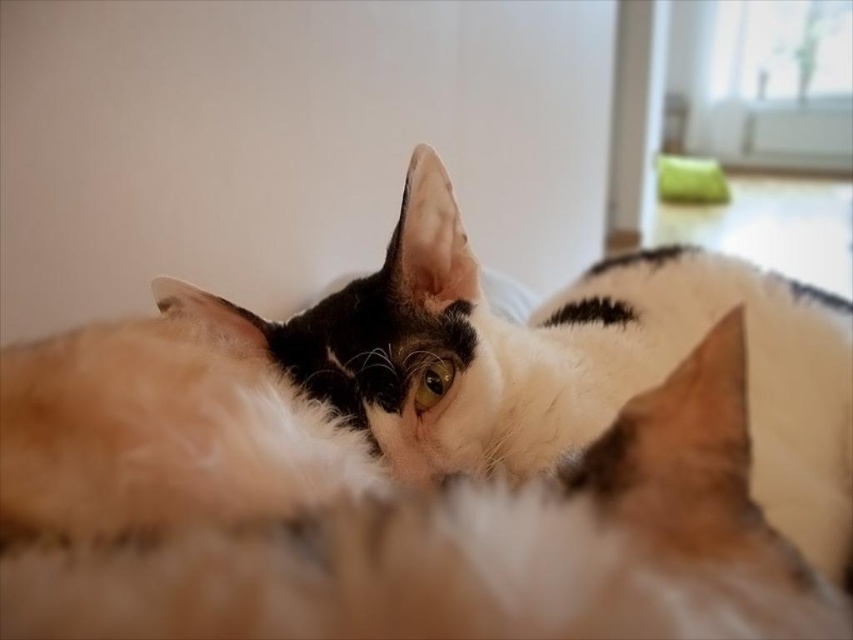
Is fluffy white cat at center above green fabric pillow at upper right?

Incorrect, fluffy white cat at center is not positioned above green fabric pillow at upper right.

Which is more to the left, fluffy white cat at center or green fabric pillow at upper right?

fluffy white cat at center is more to the left.

Where is `fluffy white cat at center`? The width and height of the screenshot is (853, 640). fluffy white cat at center is located at coordinates (566, 362).